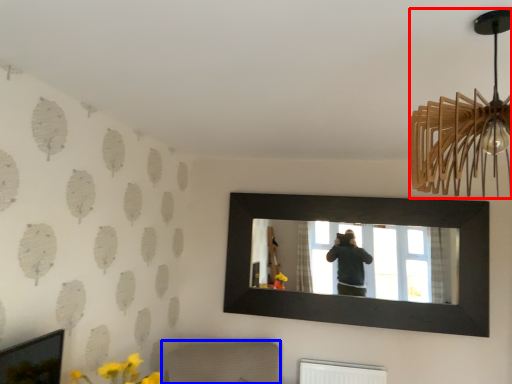
Question: Which of the following is the farthest to the observer, lamp (highlighted by a red box) or furniture (highlighted by a blue box)?

Choices:
 (A) lamp
 (B) furniture

Answer: (B)